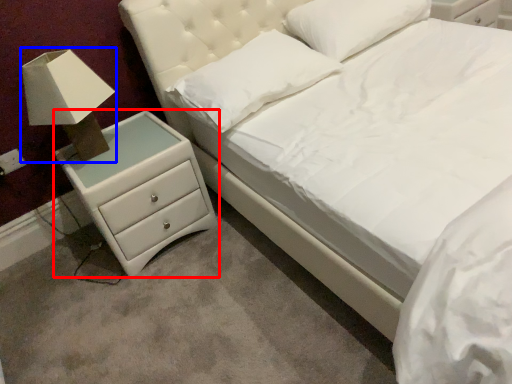
Question: Which object appears farthest to the camera in this image, chest of drawers (highlighted by a red box) or table lamp (highlighted by a blue box)?

Choices:
 (A) chest of drawers
 (B) table lamp

Answer: (A)